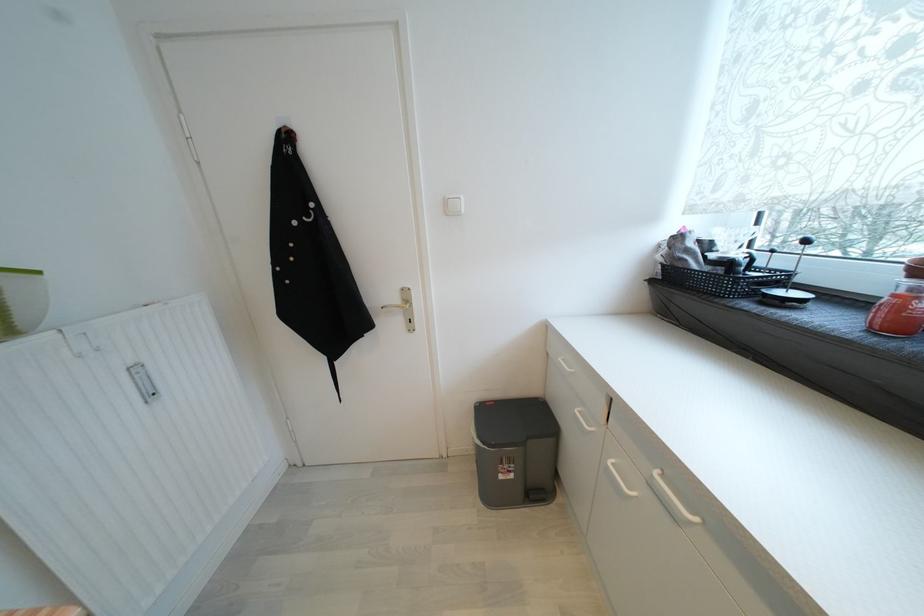
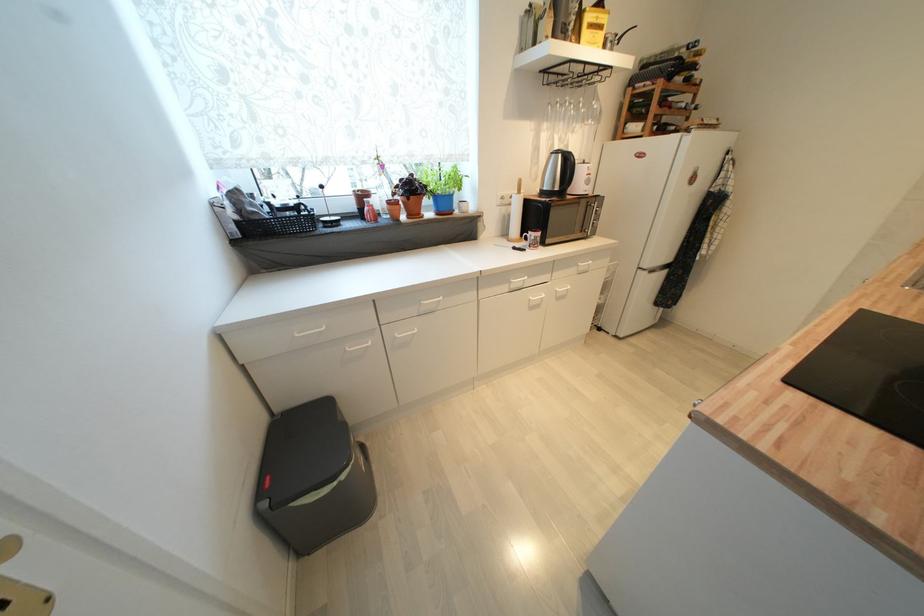
Locate, in the second image, the point that corresponds to (x=667, y=268) in the first image.

(242, 225)